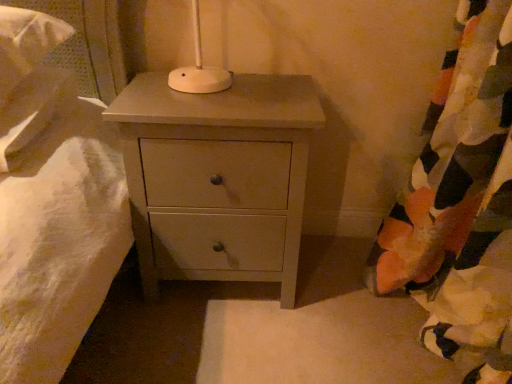
Question: Considering the positions of floral fabric curtain at right and matte white chest of drawers at center in the image, is floral fabric curtain at right taller or shorter than matte white chest of drawers at center?

Choices:
 (A) tall
 (B) short

Answer: (A)

Question: Is point (483, 167) positioned closer to the camera than point (186, 97)?

Choices:
 (A) farther
 (B) closer

Answer: (B)

Question: From a real-world perspective, is floral fabric curtain at right above or below matte white chest of drawers at center?

Choices:
 (A) below
 (B) above

Answer: (B)

Question: Is matte white chest of drawers at center in front of or behind floral fabric curtain at right in the image?

Choices:
 (A) behind
 (B) front

Answer: (A)

Question: From a real-world perspective, is matte white chest of drawers at center physically located above or below floral fabric curtain at right?

Choices:
 (A) above
 (B) below

Answer: (B)

Question: Is matte white chest of drawers at center wider or thinner than floral fabric curtain at right?

Choices:
 (A) thin
 (B) wide

Answer: (B)

Question: Is matte white chest of drawers at center taller or shorter than floral fabric curtain at right?

Choices:
 (A) short
 (B) tall

Answer: (A)